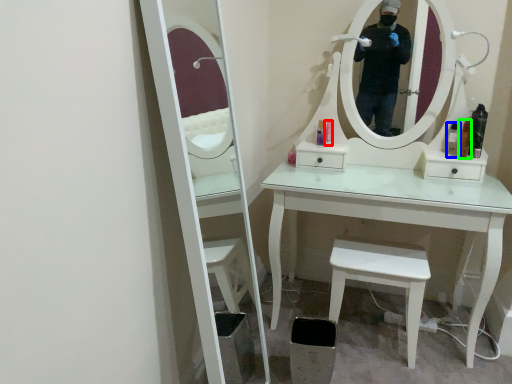
Question: Estimate the real-world distances between objects in this image. Which object is closer to toiletry (highlighted by a red box), toiletry (highlighted by a blue box) or toiletry (highlighted by a green box)?

Choices:
 (A) toiletry
 (B) toiletry

Answer: (A)